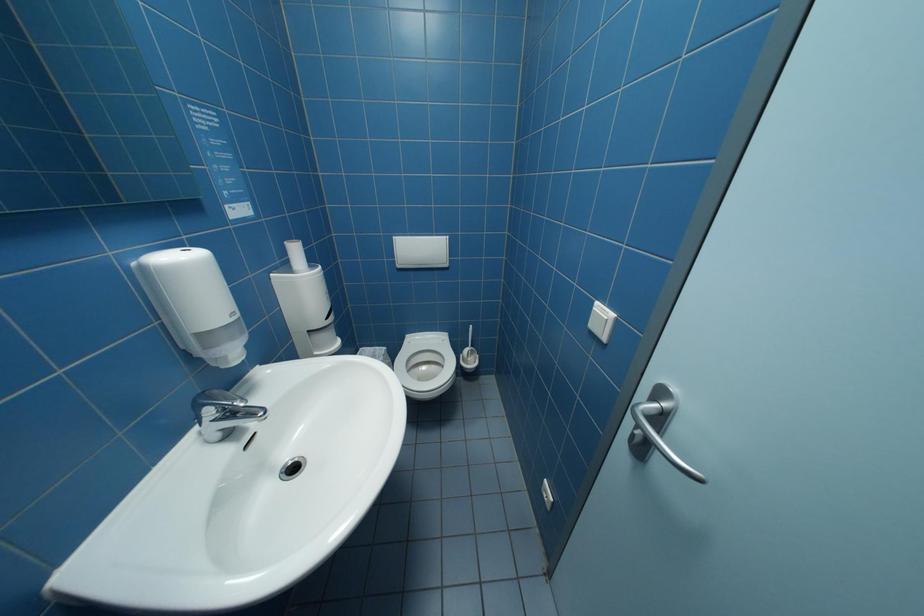
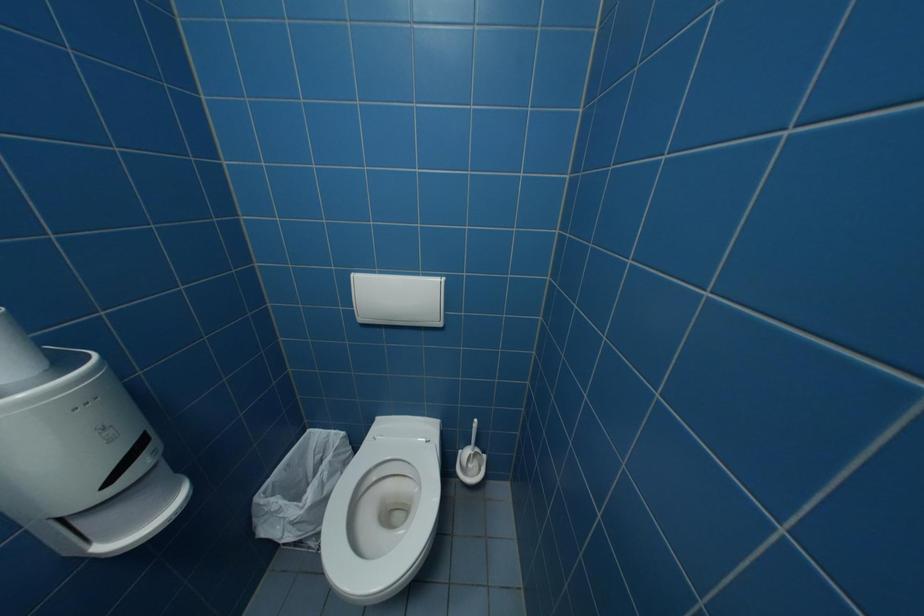
Question: Which direction would the cameraman need to move to produce the second image? Reply with the corresponding letter.

Choices:
 (A) Left
 (B) Right
 (C) Forward
 (D) Backward

Answer: (C)